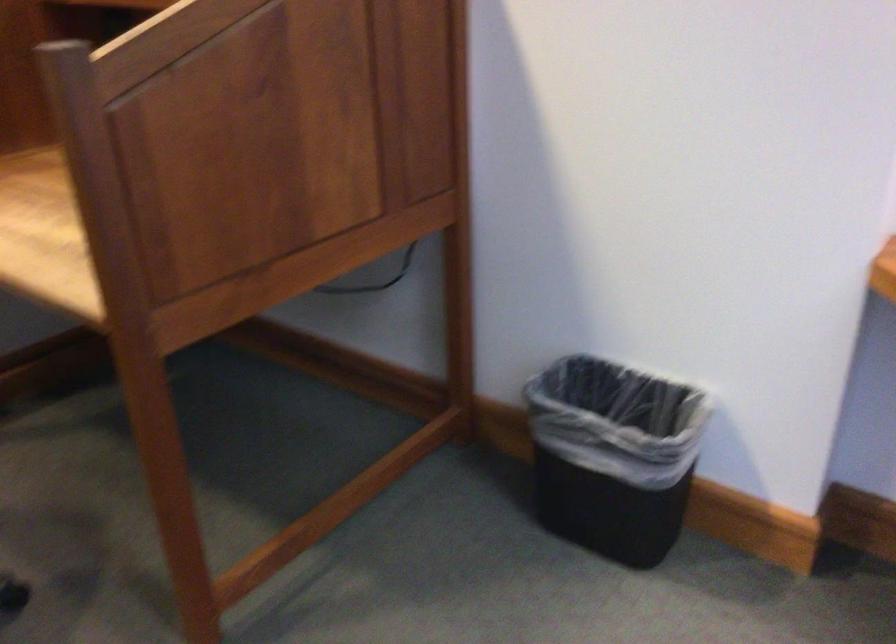
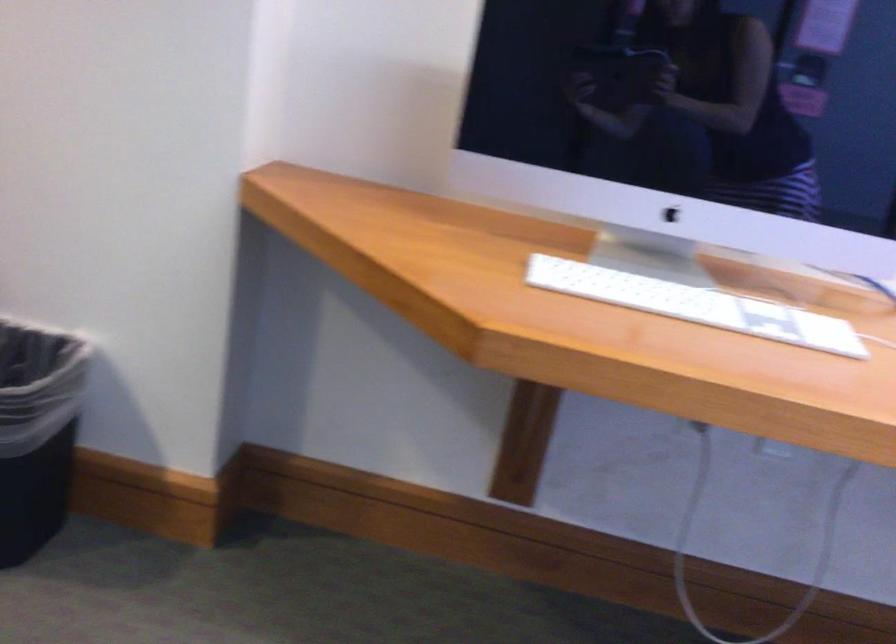
Question: How did the camera likely rotate?

Choices:
 (A) Left
 (B) Right
 (C) Up
 (D) Down

Answer: (B)